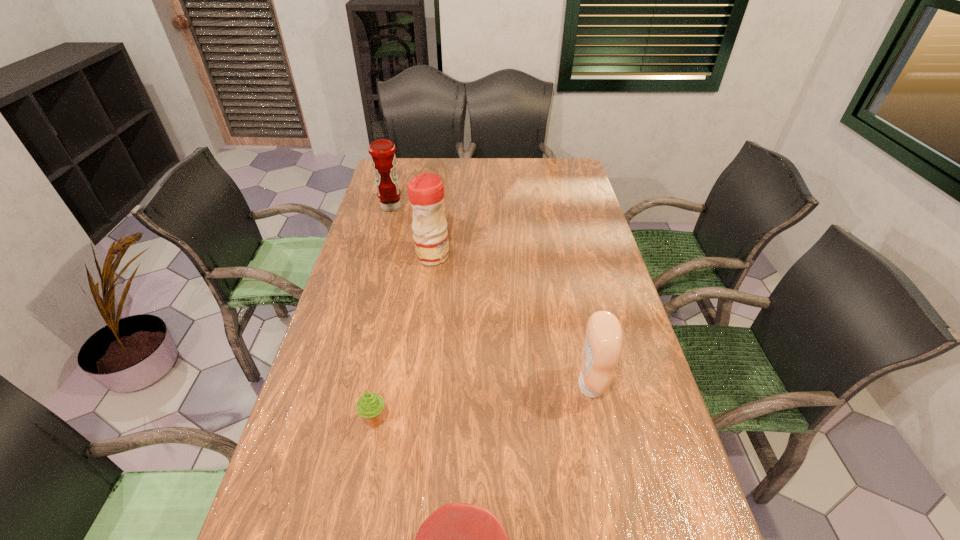
This screenshot has width=960, height=540. I want to click on the second nearest condiment, so click(x=425, y=191).

You are a GUI agent. You are given a task and a screenshot of the screen. Output one action in this format:
    pyautogui.click(x=<x>, y=<y>)
    Task: Click on the second farthest object
    Image resolution: width=960 pixels, height=540 pixels.
    Given the screenshot: What is the action you would take?
    tap(425, 191)

Where is `the leftmost object`? The width and height of the screenshot is (960, 540). the leftmost object is located at coordinates (382, 151).

Where is `the leftmost condiment`? Image resolution: width=960 pixels, height=540 pixels. the leftmost condiment is located at coordinates (382, 151).

Locate an element on the screen. the nearest condiment is located at coordinates (602, 348).

Locate an element on the screen. Image resolution: width=960 pixels, height=540 pixels. the third nearest object is located at coordinates (602, 348).

Image resolution: width=960 pixels, height=540 pixels. Find the location of `icecream`. icecream is located at coordinates (370, 405).

Find the location of `the second nearest object`. the second nearest object is located at coordinates (370, 405).

The width and height of the screenshot is (960, 540). In order to click on vacant space located on the right of the second farthest condiment in this screenshot , I will do `click(482, 256)`.

Where is `vacant space located on the front of the farthest condiment`? vacant space located on the front of the farthest condiment is located at coordinates (385, 229).